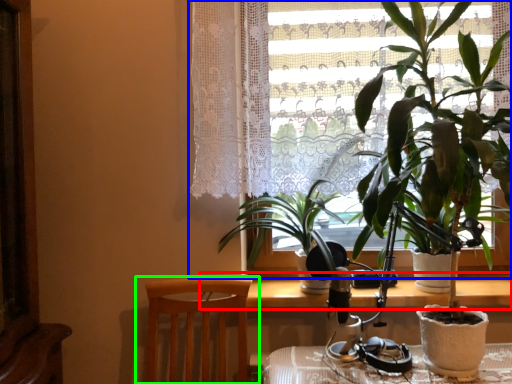
Question: Which object is positioned farthest from table (highlighted by a red box)? Select from window (highlighted by a blue box) and chair (highlighted by a green box).

Choices:
 (A) window
 (B) chair

Answer: (A)